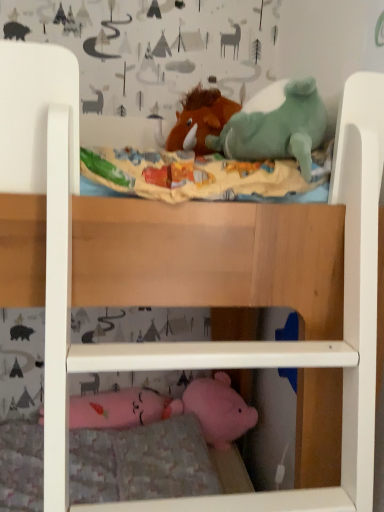
Question: Is brown plush horse at upper center bigger or smaller than pink plush at lower center?

Choices:
 (A) small
 (B) big

Answer: (A)

Question: Considering the positions of point (225, 101) and point (140, 444), is point (225, 101) closer or farther from the camera than point (140, 444)?

Choices:
 (A) farther
 (B) closer

Answer: (B)

Question: Based on their positions, is brown plush horse at upper center located to the left or right of pink plush at lower center?

Choices:
 (A) right
 (B) left

Answer: (A)

Question: In terms of width, does pink plush at lower center look wider or thinner when compared to brown plush horse at upper center?

Choices:
 (A) thin
 (B) wide

Answer: (B)

Question: In the image, is pink plush at lower center on the left side or the right side of brown plush horse at upper center?

Choices:
 (A) left
 (B) right

Answer: (A)

Question: In terms of height, does pink plush at lower center look taller or shorter compared to brown plush horse at upper center?

Choices:
 (A) tall
 (B) short

Answer: (B)

Question: From a real-world perspective, is pink plush at lower center above or below brown plush horse at upper center?

Choices:
 (A) above
 (B) below

Answer: (B)